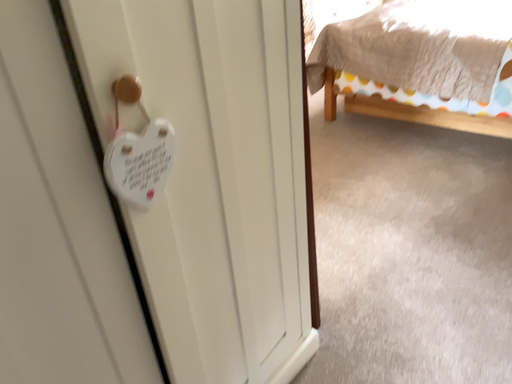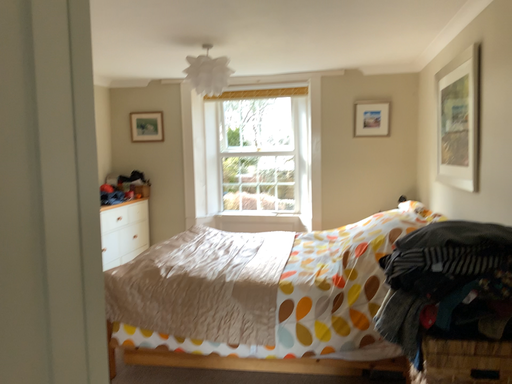
Question: How did the camera likely rotate when shooting the video?

Choices:
 (A) rotated left
 (B) rotated right

Answer: (B)